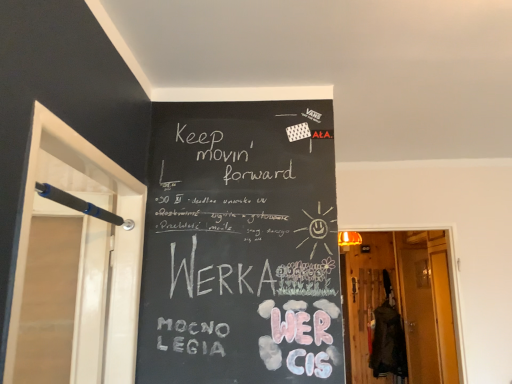
Question: Is translucent glass screen door at right, acting as the second screen door starting from the left, at the left side of wooden door at center?

Choices:
 (A) no
 (B) yes

Answer: (A)

Question: Is translucent glass screen door at right, which ranks as the 2th screen door in top-to-bottom order, not within wooden door at center?

Choices:
 (A) yes
 (B) no

Answer: (A)

Question: Is translucent glass screen door at right, the 1th screen door positioned from the back, smaller than wooden door at center?

Choices:
 (A) yes
 (B) no

Answer: (A)

Question: Could you tell me if translucent glass screen door at right, the second screen door when ordered from front to back, is facing wooden door at center?

Choices:
 (A) yes
 (B) no

Answer: (B)

Question: From a real-world perspective, is translucent glass screen door at right, which ranks as the 2th screen door in top-to-bottom order, positioned under wooden door at center based on gravity?

Choices:
 (A) no
 (B) yes

Answer: (B)

Question: Considering the positions of translucent glass screen door at right, acting as the second screen door starting from the left, and wooden door at center in the image, is translucent glass screen door at right, acting as the second screen door starting from the left, taller or shorter than wooden door at center?

Choices:
 (A) short
 (B) tall

Answer: (B)

Question: Considering the positions of point (417, 291) and point (384, 264), is point (417, 291) closer or farther from the camera than point (384, 264)?

Choices:
 (A) farther
 (B) closer

Answer: (B)

Question: From the image's perspective, relative to wooden door at center, is translucent glass screen door at right, which appears as the first screen door when viewed from the right, above or below?

Choices:
 (A) above
 (B) below

Answer: (B)

Question: From a real-world perspective, is translucent glass screen door at right, the first screen door positioned from the bottom, positioned above or below wooden door at center?

Choices:
 (A) above
 (B) below

Answer: (B)

Question: In terms of width, does wooden door at center look wider or thinner when compared to translucent glass screen door at right, which appears as the first screen door when viewed from the right?

Choices:
 (A) thin
 (B) wide

Answer: (B)

Question: From a real-world perspective, relative to translucent glass screen door at right, which appears as the first screen door when viewed from the right, is wooden door at center vertically above or below?

Choices:
 (A) below
 (B) above

Answer: (B)

Question: In terms of height, does wooden door at center look taller or shorter compared to translucent glass screen door at right, the first screen door positioned from the bottom?

Choices:
 (A) tall
 (B) short

Answer: (B)

Question: Do you think wooden door at center is within translucent glass screen door at right, acting as the second screen door starting from the left, or outside of it?

Choices:
 (A) outside
 (B) inside

Answer: (A)

Question: Is black plastic screen door at left, which appears as the 2th screen door when ordered from the bottom, taller or shorter than wooden door at center?

Choices:
 (A) short
 (B) tall

Answer: (A)

Question: Relative to wooden door at center, is black plastic screen door at left, the 1th screen door when ordered from left to right, in front or behind?

Choices:
 (A) behind
 (B) front

Answer: (B)